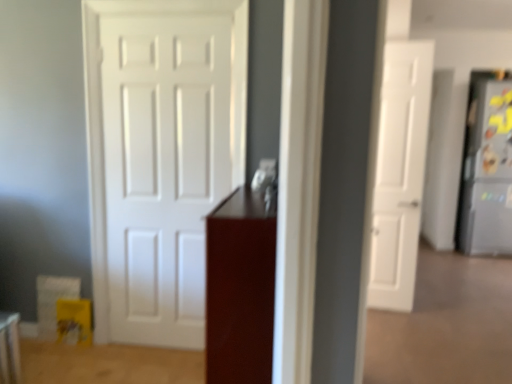
Question: In which direction should I rotate to look at white matte door at center, positioned as the 1th door in left-to-right order?

Choices:
 (A) left
 (B) right

Answer: (A)

Question: Is glossy wood cabinet at center not within white matte door at center, the second door when ordered from back to front?

Choices:
 (A) no
 (B) yes

Answer: (B)

Question: Could you tell me if glossy wood cabinet at center is turned towards white matte door at center, the second door when ordered from back to front?

Choices:
 (A) no
 (B) yes

Answer: (B)

Question: From the image's perspective, is glossy wood cabinet at center above white matte door at center, positioned as the 1th door in front-to-back order?

Choices:
 (A) no
 (B) yes

Answer: (A)

Question: Considering the relative sizes of glossy wood cabinet at center and white matte door at center, placed as the 2th door when sorted from right to left, in the image provided, is glossy wood cabinet at center shorter than white matte door at center, placed as the 2th door when sorted from right to left,?

Choices:
 (A) no
 (B) yes

Answer: (B)

Question: Is glossy wood cabinet at center at the left side of white matte door at center, placed as the 2th door when sorted from right to left?

Choices:
 (A) yes
 (B) no

Answer: (B)

Question: From the image's perspective, would you say glossy wood cabinet at center is shown under white matte door at center, positioned as the 1th door in left-to-right order?

Choices:
 (A) yes
 (B) no

Answer: (A)

Question: Can you confirm if satin silver refrigerator at right is shorter than white matte door at center, positioned as the 1th door in left-to-right order?

Choices:
 (A) no
 (B) yes

Answer: (B)

Question: Is satin silver refrigerator at right taller than white matte door at center, positioned as the 1th door in left-to-right order?

Choices:
 (A) no
 (B) yes

Answer: (A)

Question: Is satin silver refrigerator at right behind white matte door at center, the second door when ordered from back to front?

Choices:
 (A) yes
 (B) no

Answer: (A)

Question: Are satin silver refrigerator at right and white matte door at center, the second door when ordered from back to front, making contact?

Choices:
 (A) no
 (B) yes

Answer: (A)

Question: From the image's perspective, is satin silver refrigerator at right above white matte door at center, placed as the 2th door when sorted from right to left?

Choices:
 (A) yes
 (B) no

Answer: (A)

Question: Is satin silver refrigerator at right closer to the viewer compared to white matte door at center, placed as the 2th door when sorted from right to left?

Choices:
 (A) no
 (B) yes

Answer: (A)

Question: Would you consider satin silver refrigerator at right to be distant from glossy wood cabinet at center?

Choices:
 (A) yes
 (B) no

Answer: (A)